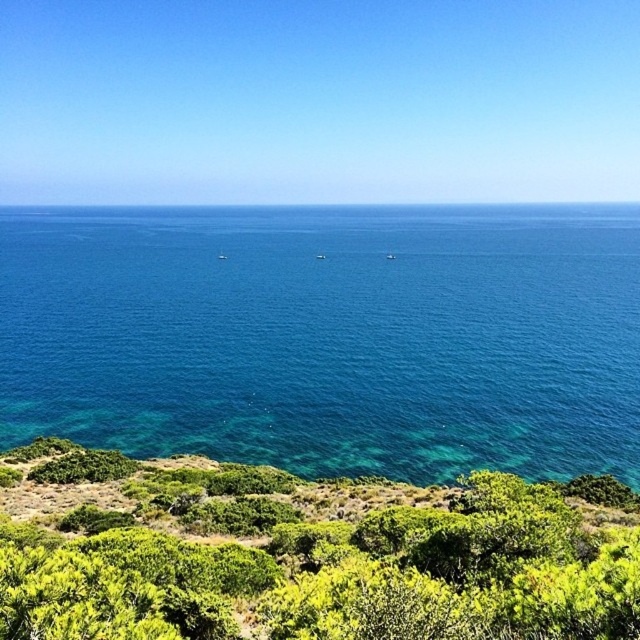
Does clear blue water at center have a greater width compared to green leafy shrubs at lower center?

Yes, clear blue water at center is wider than green leafy shrubs at lower center.

Is point (353, 253) positioned after point (348, 502)?

Yes, it is behind point (348, 502).

This screenshot has height=640, width=640. I want to click on clear blue water at center, so click(328, 337).